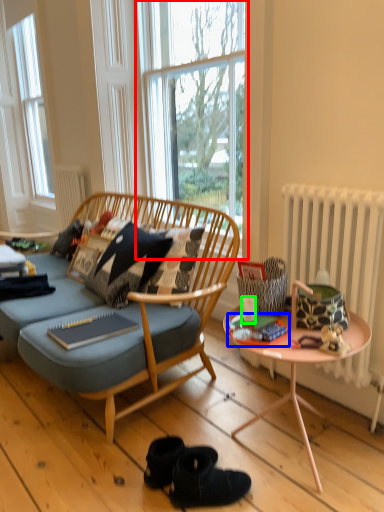
Question: Which object is positioned farthest from window (highlighted by a red box)? Select from magazine (highlighted by a blue box) and coffee cup (highlighted by a green box).

Choices:
 (A) magazine
 (B) coffee cup

Answer: (A)